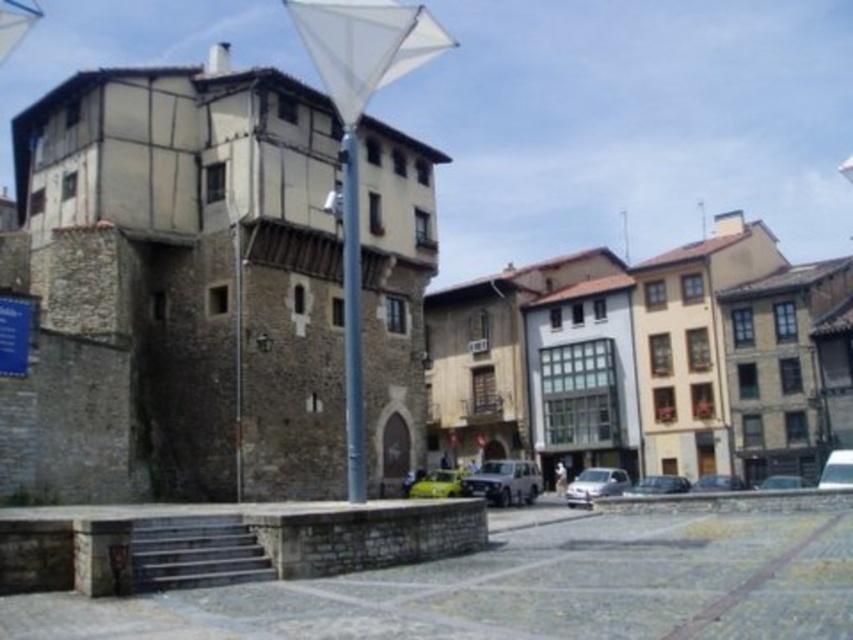
Question: Can you confirm if blue glossy pole at center is bigger than silver metallic car at center?

Choices:
 (A) no
 (B) yes

Answer: (B)

Question: Which is farther from the shiny black car at center?

Choices:
 (A) metallic silver car at center
 (B) shiny silver car at lower center

Answer: (A)

Question: Can you confirm if silver metallic car at center is bigger than shiny black car at center?

Choices:
 (A) yes
 (B) no

Answer: (A)

Question: Where is silver metallic car at center located in relation to shiny silver car at lower center in the image?

Choices:
 (A) left
 (B) right

Answer: (A)

Question: Which object appears farthest from the camera in this image?

Choices:
 (A) metallic silver suv at center
 (B) yellow matte car at center
 (C) shiny black car at center
 (D) metallic silver car at center

Answer: (C)

Question: Which point is closer to the camera?

Choices:
 (A) click(637, 481)
 (B) click(619, 470)
 (C) click(448, 497)
 (D) click(497, 476)

Answer: (C)